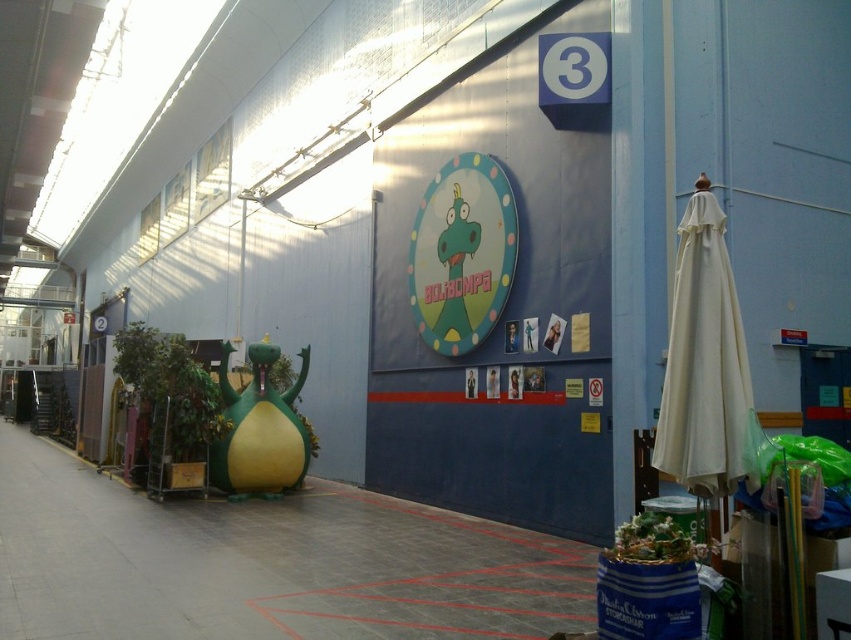
You are an event planner setting up a booth in the hall. You have a new poster to hang on the wall where the matte blue bulletin board at center and the matte plastic clock at center are located. If you want the poster to be visible behind these items, where should you place it?

The matte blue bulletin board at center is in front of the matte plastic clock at center. To place the poster so it is visible behind both items, you should position it behind the matte blue bulletin board at center.

You are organizing a school event and need to hang a banner between the matte blue bulletin board at center and the matte plastic clock at center. Which object should the banner be placed to the left of to ensure it aligns with the existing layout?

The banner should be placed to the left of the matte plastic clock at center because the matte blue bulletin board at center is on the right side of the matte plastic clock at center, so placing the banner to the left of the clock maintains alignment with the layout.

You are an event planner setting up a booth in the hall. You have a large banner that needs to be placed between the matte blue bulletin board at center and the matte plastic clock at center. The banner requires 8 feet of space. Based on the scene, will the banner fit between them?

The distance between the matte blue bulletin board at center and the matte plastic clock at center is 7.07 feet. Since the banner requires 8 feet of space, it will not fit between them as the available space is shorter than needed.